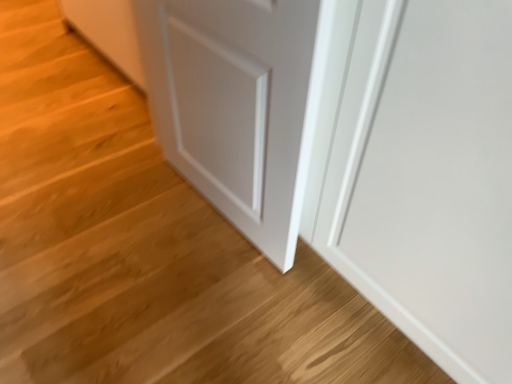
Question: Should I look upward or downward to see white matte door at center?

Choices:
 (A) down
 (B) up

Answer: (B)